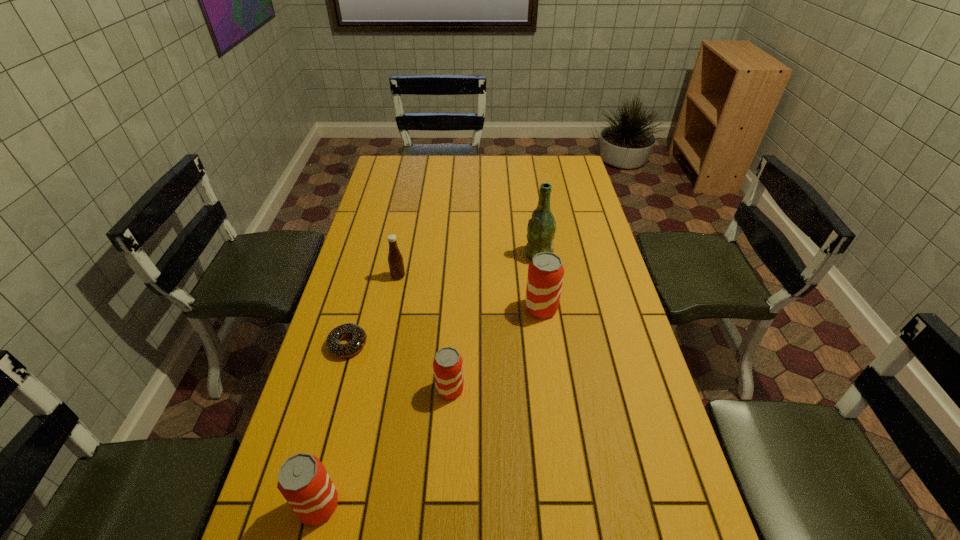
What are the coordinates of `beer bottle` in the screenshot? It's located at (541, 228).

The height and width of the screenshot is (540, 960). Find the location of `the tallest object`. the tallest object is located at coordinates (541, 228).

I want to click on free space located on the back of the second tallest beer can, so click(342, 411).

This screenshot has width=960, height=540. What are the coordinates of `free space located on the left of the fifth tallest object` in the screenshot? It's located at (405, 389).

Image resolution: width=960 pixels, height=540 pixels. I want to click on free spot located 0.290m on the front of the rightmost beer can, so click(x=555, y=408).

Identify the location of free space located 0.370m on the back of the shortest object. (373, 250).

Identify the location of vacant space located 0.340m on the back of the fifth nearest object. [411, 213].

Where is `free point located on the surface of the beer bottle`? The width and height of the screenshot is (960, 540). free point located on the surface of the beer bottle is located at coordinates (473, 255).

The height and width of the screenshot is (540, 960). Find the location of `blank area located on the surface of the beer bottle`. blank area located on the surface of the beer bottle is located at coordinates (485, 255).

Image resolution: width=960 pixels, height=540 pixels. In order to click on vacant space located 0.060m on the surface of the beer bottle in this screenshot , I will do `click(508, 255)`.